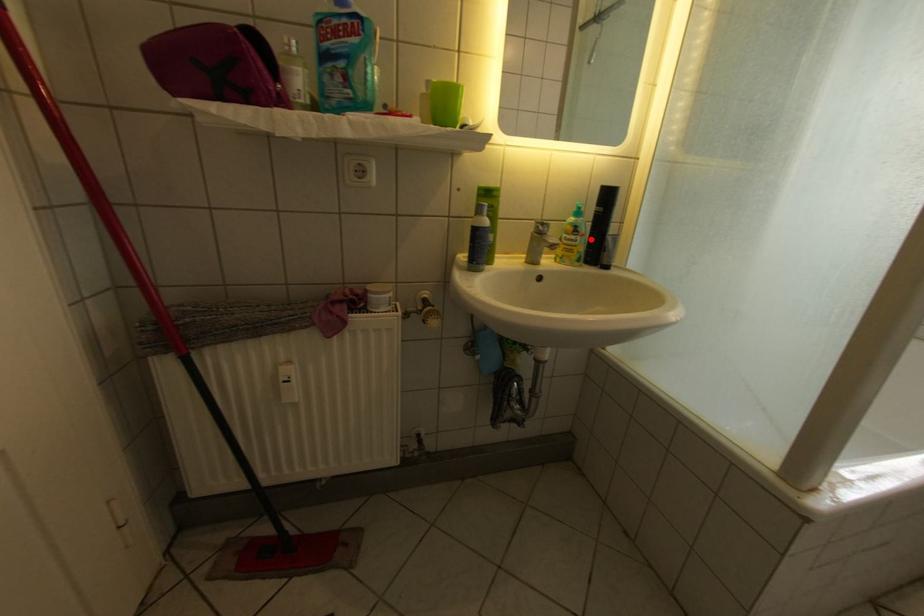
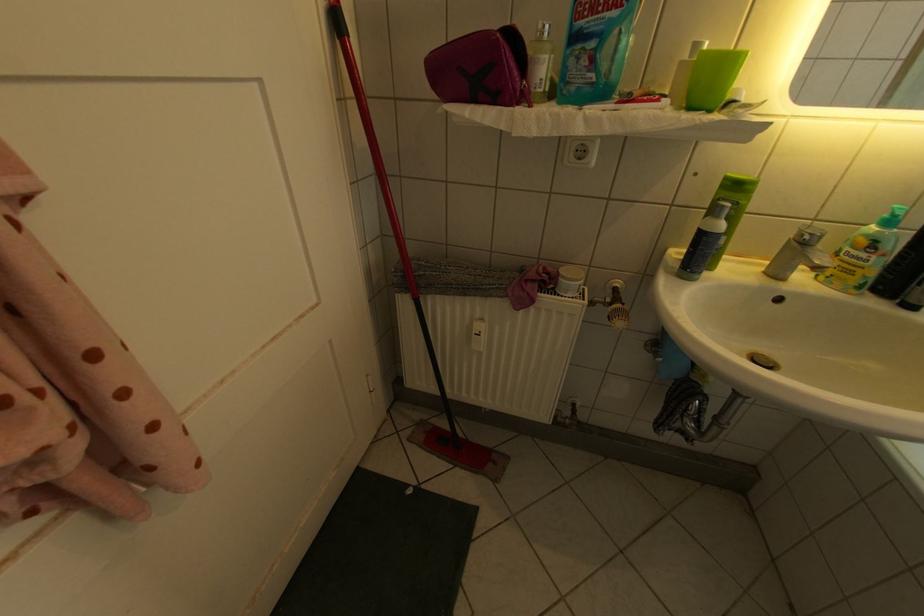
Question: I am providing you with two images of the same scene from different viewpoints. Image1 has a red point marked. In image2, the corresponding 3D location appears at what relative position? Reply with the corresponding letter.

Choices:
 (A) Closer
 (B) Farther

Answer: (B)